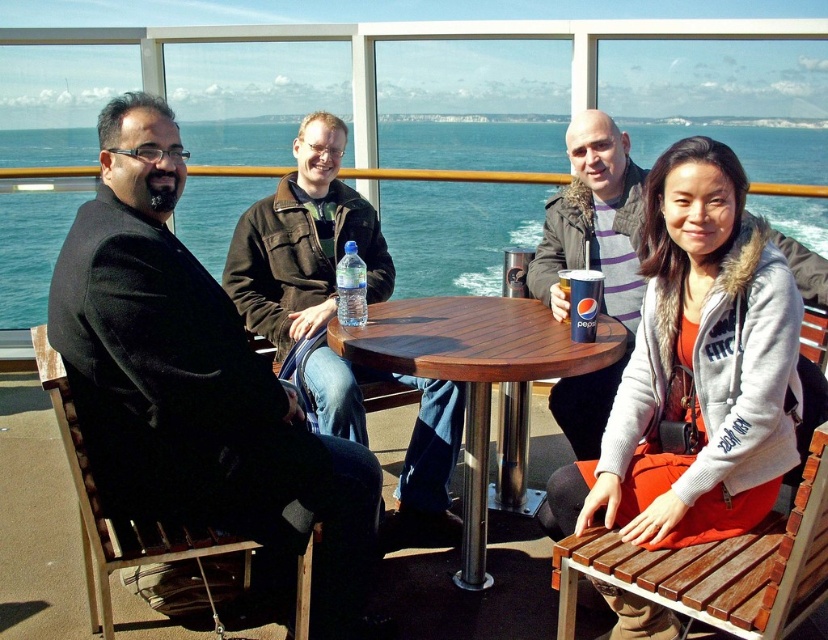
You are standing on the deck of a ship and see the dark brown leather jacket at center and the translucent plastic water bottle at center. Which object is closer to you?

The dark brown leather jacket at center is closer to you because it is further to the viewer than the translucent plastic water bottle at center.

You are standing at the center of the deck and want to hand a souvenir to the person wearing the orange fabric jacket at lower right. The deck railing is 2 meters away from you. Can you reach them without moving closer?

The distance between you and the orange fabric jacket at lower right is 1.91 meters, which is less than the 2 meters to the railing. Therefore, you can reach them without moving closer.

You are a passenger on a ferry and want to grab the translucent plastic water bottle at center without moving from your seat. Your seat is near the orange fabric jacket at lower right. Is the water bottle within reach?

The orange fabric jacket at lower right is 3.31 feet away from the translucent plastic water bottle at center. Since 3.31 feet is approximately 40 inches, which is a reasonable reaching distance for most adults, the water bottle is likely within reach from the seat near the orange fabric jacket at lower right.